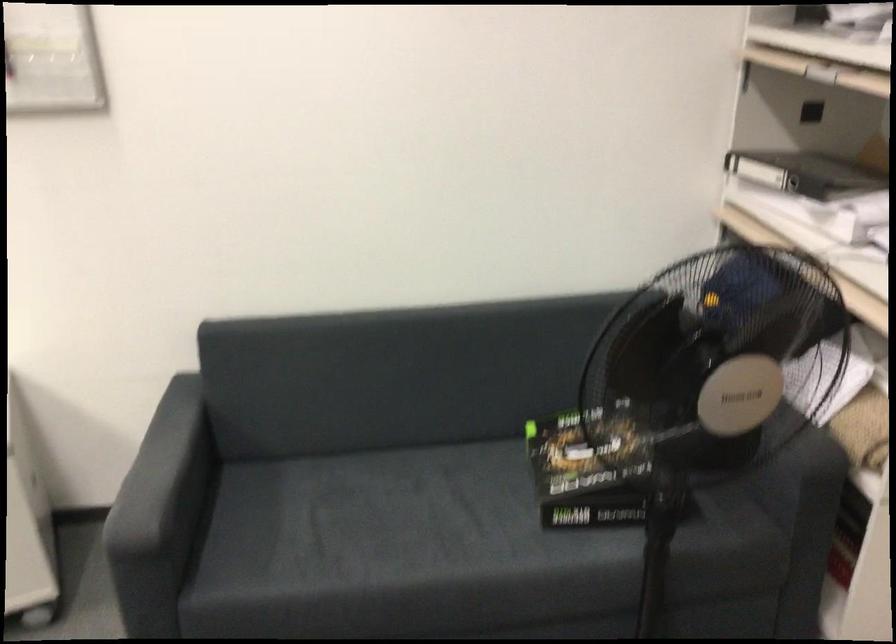
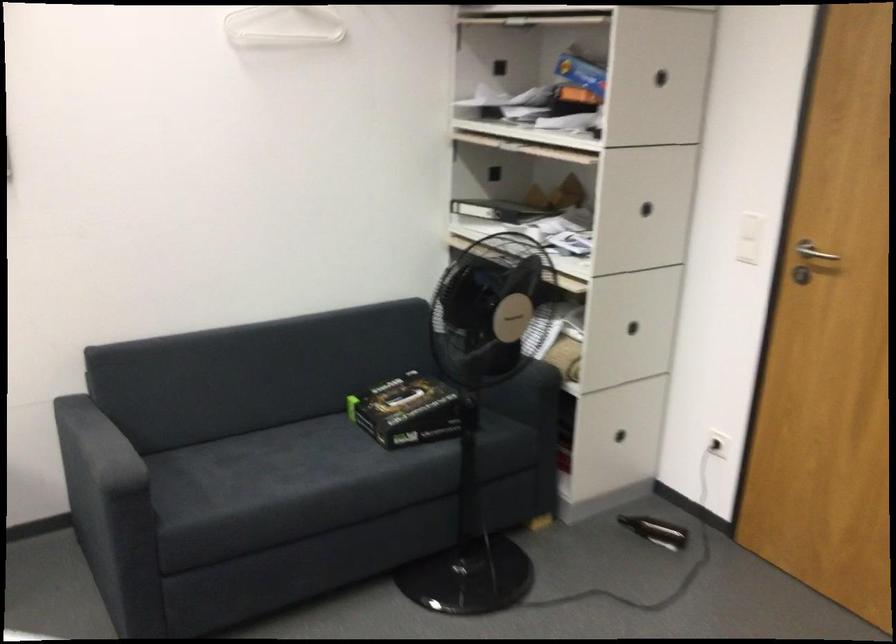
In the second image, find the point that corresponds to pixel 159 453 in the first image.

(93, 440)